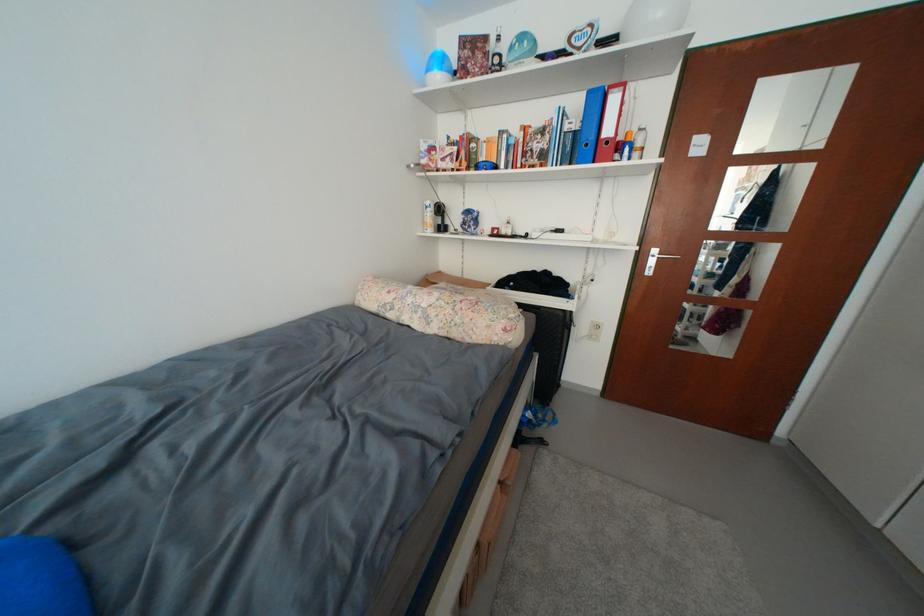
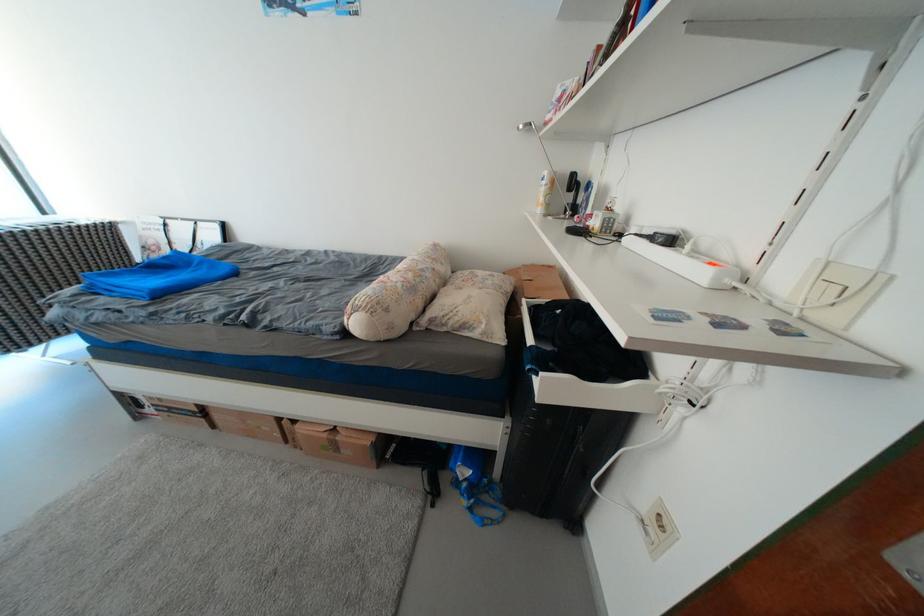
Where in the second image is the point corresponding to (431,143) from the first image?

(567, 89)